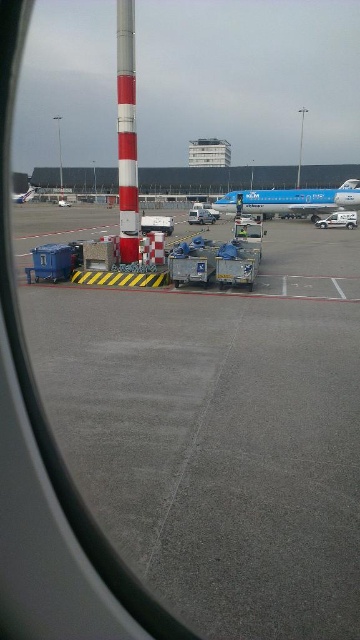
You are a passenger sitting in the airplane and looking out the window. You see a point marked at coordinates (x=127, y=132). What object is located at that point?

The point at coordinates (x=127, y=132) marks a red and white striped pole at the left.